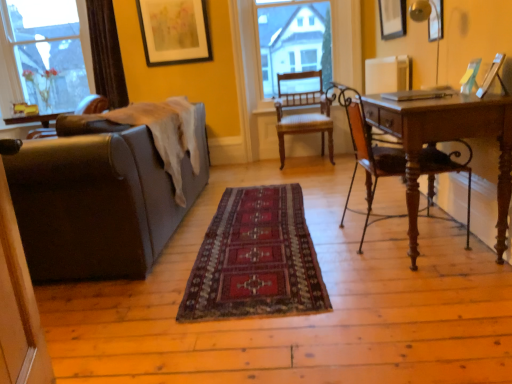
At what (x,y) coordinates should I click in order to perform the action: click on free space in front of brown wooden chair at right, which is the second chair in back-to-front order. Please return your answer as a coordinate pair (x, y). The image size is (512, 384). Looking at the image, I should click on coord(403,284).